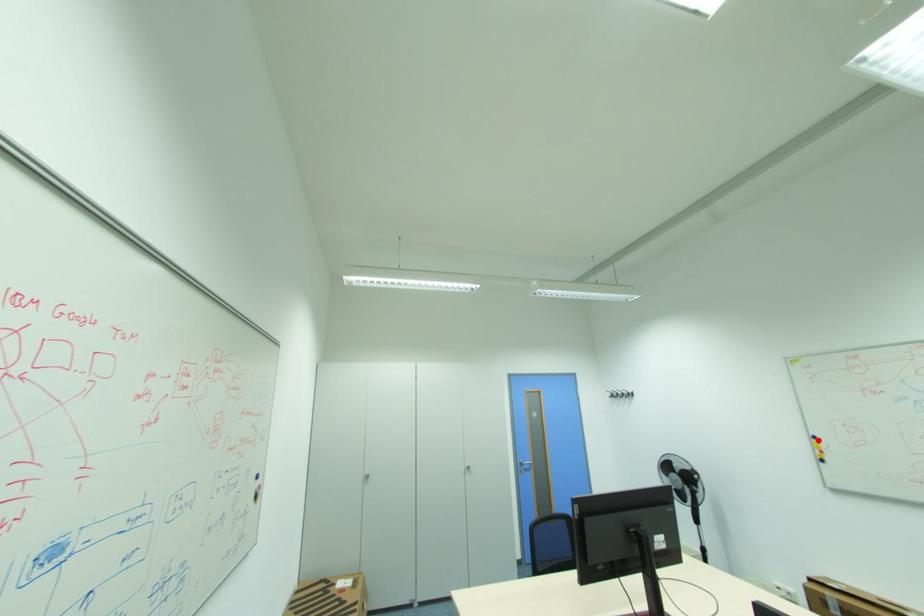
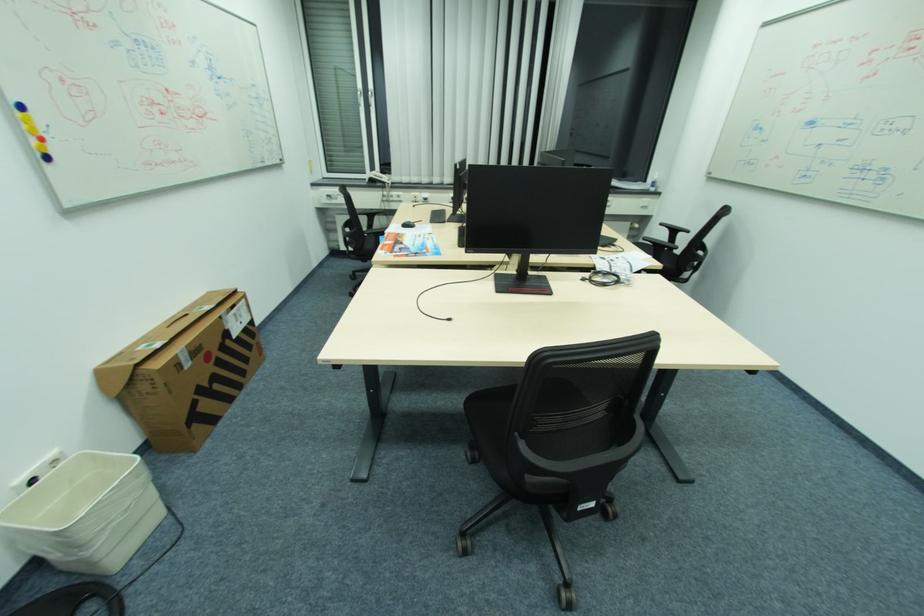
Where in the second image is the point corresponding to the highlighted location from the first image?

(21, 114)